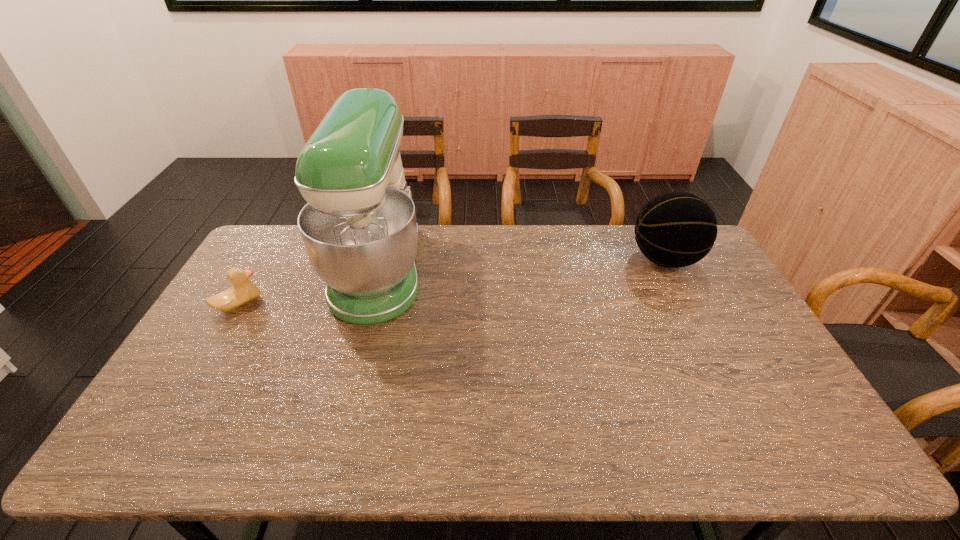
At what (x,y) coordinates should I click in order to perform the action: click on empty space between the duck and the mixer. Please return your answer as a coordinate pair (x, y). This screenshot has height=540, width=960. Looking at the image, I should click on (309, 287).

In order to click on vacant area that lies between the second object from left to right and the shortest object in this screenshot , I will do (x=309, y=287).

Identify the location of free point between the mixer and the second shortest object. (522, 265).

Where is `unoccupied area between the duck and the basketball`? This screenshot has height=540, width=960. unoccupied area between the duck and the basketball is located at coordinates (452, 282).

Identify the location of unoccupied position between the mixer and the duck. This screenshot has height=540, width=960. (309, 287).

You are a GUI agent. You are given a task and a screenshot of the screen. Output one action in this format:
    pyautogui.click(x=<x>, y=<y>)
    Task: Click on the free space between the mixer and the rightmost object
    Image resolution: width=960 pixels, height=540 pixels.
    Given the screenshot: What is the action you would take?
    pyautogui.click(x=522, y=265)

Where is `free point between the second object from right to left and the leftmost object`? This screenshot has height=540, width=960. free point between the second object from right to left and the leftmost object is located at coordinates (309, 287).

Locate an element on the screen. Image resolution: width=960 pixels, height=540 pixels. vacant area between the duck and the second object from left to right is located at coordinates (309, 287).

Identify which object is located as the second nearest to the shortest object. Please provide its 2D coordinates. Your answer should be formatted as a tuple, i.e. [(x, y)], where the tuple contains the x and y coordinates of a point satisfying the conditions above.

[(676, 229)]

The width and height of the screenshot is (960, 540). I want to click on the second closest object to the shortest object, so click(x=676, y=229).